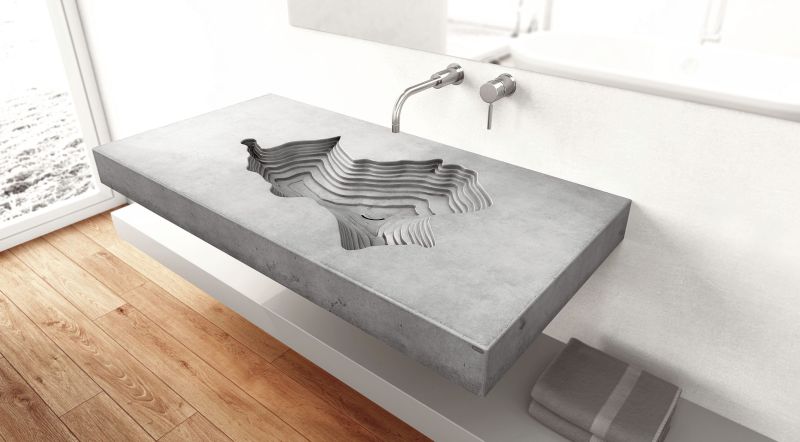
I want to click on longer edge sink, so click(x=378, y=329).